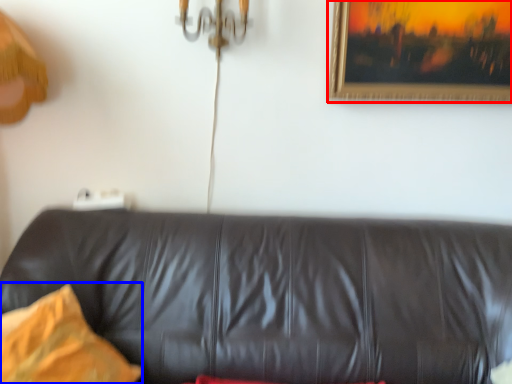
Question: Which object appears farthest to the camera in this image, picture frame (highlighted by a red box) or pillow (highlighted by a blue box)?

Choices:
 (A) picture frame
 (B) pillow

Answer: (A)